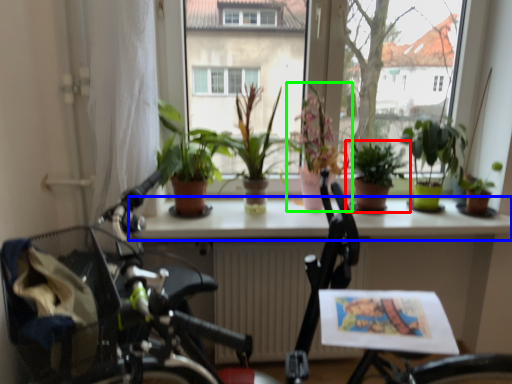
Question: Which object is the closest to the houseplant (highlighted by a red box)? Choose among these: window sill (highlighted by a blue box) or houseplant (highlighted by a green box).

Choices:
 (A) window sill
 (B) houseplant

Answer: (B)